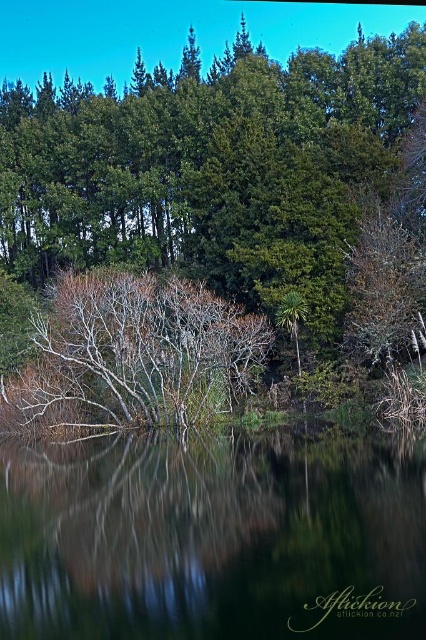
Based on the photo, you are a bird flying over the serene natural scene. You notice the transparent water at center and the bare branches at center. Which object is located below the other?

The transparent water at center is positioned under the bare branches at center, so the water is below the branches.

From the picture: You are standing at the origin point in this serene natural scene. Where is the green leafy tree at center located in terms of coordinates?

The green leafy tree at center is located at coordinates point (210, 168).

You are standing in the serene natural scene described. You notice the green leafy tree at center and the transparent water at center. Which object appears larger in the image?

The green leafy tree at center appears larger than the transparent water at center in the image.